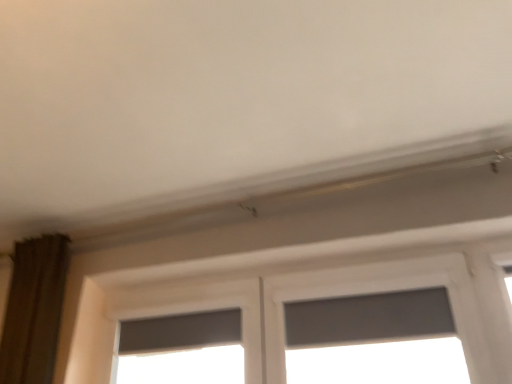
What are the coordinates of `matte gray window at center` in the screenshot? It's located at (182, 349).

Describe the element at coordinates (182, 349) in the screenshot. I see `matte gray window at center` at that location.

The width and height of the screenshot is (512, 384). What do you see at coordinates (369, 318) in the screenshot? I see `gray matte window screen at center` at bounding box center [369, 318].

The width and height of the screenshot is (512, 384). I want to click on gray matte window screen at center, so click(369, 318).

Measure the distance between gray matte window screen at center and camera.

gray matte window screen at center and camera are 5.11 feet apart.

Identify the location of matte gray window at center. click(x=182, y=349).

Visually, is gray matte window screen at center positioned to the left or to the right of matte gray window at center?

Clearly, gray matte window screen at center is on the right of matte gray window at center in the image.

Considering their positions, is gray matte window screen at center located in front of or behind matte gray window at center?

In the image, gray matte window screen at center appears in front of matte gray window at center.

Considering the points (434, 331) and (202, 379), which point is behind, point (434, 331) or point (202, 379)?

The point (202, 379) is farther.

From the image's perspective, relative to matte gray window at center, is gray matte window screen at center above or below?

From the image's perspective, gray matte window screen at center appears above matte gray window at center.

From a real-world perspective, who is located lower, gray matte window screen at center or matte gray window at center?

gray matte window screen at center.

Does gray matte window screen at center have a lesser width compared to matte gray window at center?

Incorrect, the width of gray matte window screen at center is not less than that of matte gray window at center.

In the scene shown: Considering the sizes of objects gray matte window screen at center and matte gray window at center in the image provided, who is shorter, gray matte window screen at center or matte gray window at center?

matte gray window at center is shorter.

Based on the photo, which of these two, gray matte window screen at center or matte gray window at center, is smaller?

Smaller between the two is matte gray window at center.

Is matte gray window at center located within gray matte window screen at center?

No, matte gray window at center is not a part of gray matte window screen at center.

Is gray matte window screen at center beside matte gray window at center?

gray matte window screen at center is not next to matte gray window at center, and they're not touching.

Is gray matte window screen at center facing towards matte gray window at center?

No, gray matte window screen at center is not aimed at matte gray window at center.

How many degrees apart are the facing directions of gray matte window screen at center and matte gray window at center?

The facing directions of gray matte window screen at center and matte gray window at center are 0.000299 degrees apart.

This screenshot has width=512, height=384. In the image, there is a matte gray window at center. In order to click on window screen above it (from the image's perspective) in this screenshot , I will do `click(369, 318)`.

Can you confirm if matte gray window at center is positioned to the right of gray matte window screen at center?

No.

Does matte gray window at center lie in front of gray matte window screen at center?

No, matte gray window at center is further to the viewer.

Is point (231, 380) positioned behind point (290, 340)?

Yes, it is.

From the image's perspective, relative to gray matte window screen at center, is matte gray window at center above or below?

From the image's perspective, matte gray window at center appears below gray matte window screen at center.

From a real-world perspective, which is physically above, matte gray window at center or gray matte window screen at center?

matte gray window at center is physically above.

Considering the relative sizes of matte gray window at center and gray matte window screen at center in the image provided, is matte gray window at center thinner than gray matte window screen at center?

Yes, matte gray window at center is thinner than gray matte window screen at center.

Is matte gray window at center shorter than gray matte window screen at center?

Yes, matte gray window at center is shorter than gray matte window screen at center.

Between matte gray window at center and gray matte window screen at center, which one has smaller size?

matte gray window at center is smaller.

Is matte gray window at center not within gray matte window screen at center?

Yes.

Are matte gray window at center and gray matte window screen at center beside each other?

No, matte gray window at center is not with gray matte window screen at center.

Is matte gray window at center positioned with its back to gray matte window screen at center?

matte gray window at center does not have its back to gray matte window screen at center.

From the picture: How different are the orientations of matte gray window at center and gray matte window screen at center in degrees?

0.000299 degrees separate the facing orientations of matte gray window at center and gray matte window screen at center.

Identify the location of window screen located on the right of matte gray window at center. (369, 318).

The width and height of the screenshot is (512, 384). Find the location of `window lying below the gray matte window screen at center (from the image's perspective)`. window lying below the gray matte window screen at center (from the image's perspective) is located at coordinates (182, 349).

You are a GUI agent. You are given a task and a screenshot of the screen. Output one action in this format:
    pyautogui.click(x=<x>, y=<y>)
    Task: Click on the window behind the gray matte window screen at center
    
    Given the screenshot: What is the action you would take?
    pyautogui.click(x=182, y=349)